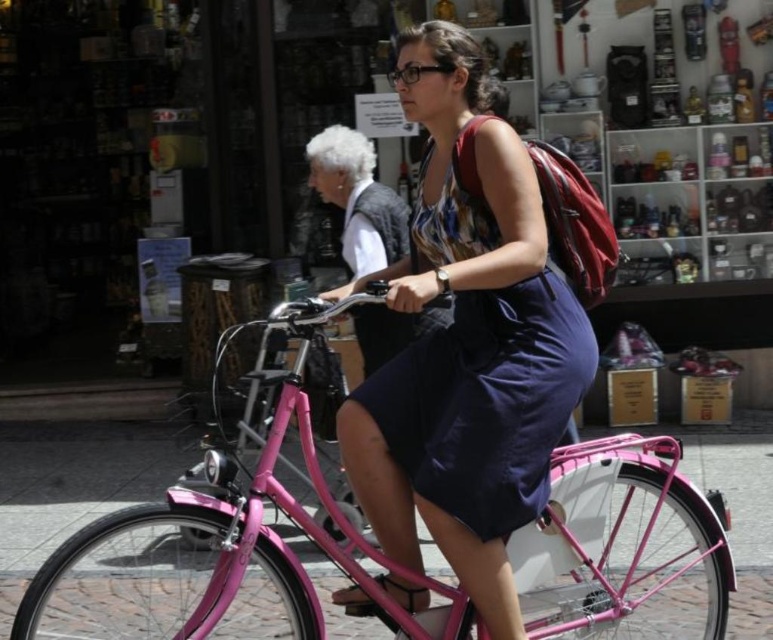
Who is more distant from viewer, (43,611) or (547,368)?

The point (43,611) is behind.

Does pink metallic bicycle at center have a lesser height compared to navy blue fabric dress at center?

No.

Is point (594, 627) positioned after point (458, 204)?

Yes, point (594, 627) is behind point (458, 204).

Find the location of a particular element. The height and width of the screenshot is (640, 773). pink metallic bicycle at center is located at coordinates pyautogui.click(x=222, y=557).